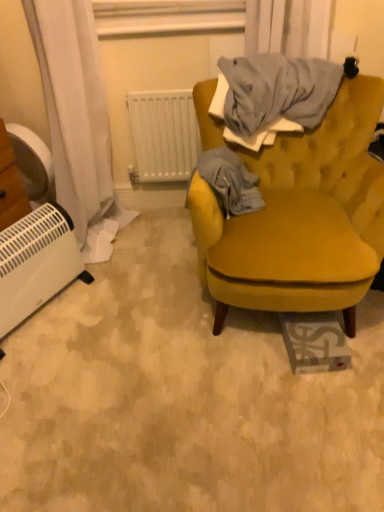
Question: Is white plastic radiator at upper center further to camera compared to white plastic fan at left?

Choices:
 (A) yes
 (B) no

Answer: (A)

Question: Does white plastic radiator at upper center have a lesser width compared to white plastic fan at left?

Choices:
 (A) yes
 (B) no

Answer: (A)

Question: Is white plastic radiator at upper center bigger than white plastic fan at left?

Choices:
 (A) yes
 (B) no

Answer: (A)

Question: Is white plastic radiator at upper center in front of white plastic fan at left?

Choices:
 (A) no
 (B) yes

Answer: (A)

Question: Would you say white plastic radiator at upper center is outside white plastic fan at left?

Choices:
 (A) yes
 (B) no

Answer: (A)

Question: From a real-world perspective, is white plastic heater at lower left physically located above or below white plastic radiator at upper center?

Choices:
 (A) below
 (B) above

Answer: (A)

Question: Considering the positions of point (64, 210) and point (188, 120), is point (64, 210) closer or farther from the camera than point (188, 120)?

Choices:
 (A) closer
 (B) farther

Answer: (A)

Question: Is white plastic heater at lower left spatially inside white plastic radiator at upper center, or outside of it?

Choices:
 (A) outside
 (B) inside

Answer: (A)

Question: Looking at their shapes, would you say white plastic heater at lower left is wider or thinner than white plastic radiator at upper center?

Choices:
 (A) wide
 (B) thin

Answer: (A)

Question: In the image, is white plastic radiator at upper center on the left side or the right side of white plastic heater at lower left?

Choices:
 (A) left
 (B) right

Answer: (B)

Question: Does point (165, 150) appear closer or farther from the camera than point (77, 257)?

Choices:
 (A) farther
 (B) closer

Answer: (A)

Question: Is white plastic radiator at upper center in front of or behind white plastic heater at lower left in the image?

Choices:
 (A) front
 (B) behind

Answer: (B)

Question: In terms of height, does white plastic radiator at upper center look taller or shorter compared to white plastic heater at lower left?

Choices:
 (A) tall
 (B) short

Answer: (A)

Question: From a real-world perspective, is velvet mustard yellow armchair at center physically located above or below gray cotton blanket at upper right?

Choices:
 (A) below
 (B) above

Answer: (A)

Question: Relative to gray cotton blanket at upper right, is velvet mustard yellow armchair at center in front or behind?

Choices:
 (A) behind
 (B) front

Answer: (B)